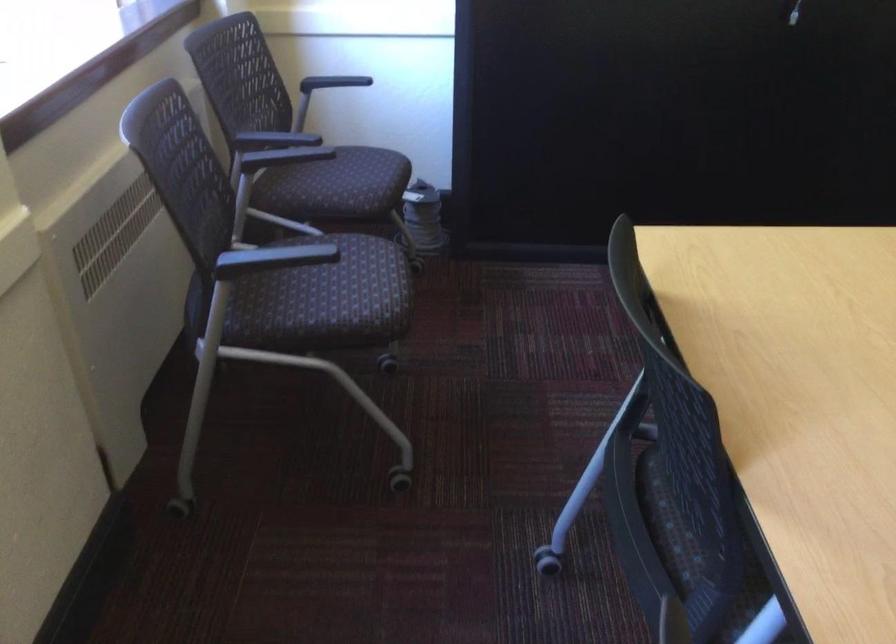
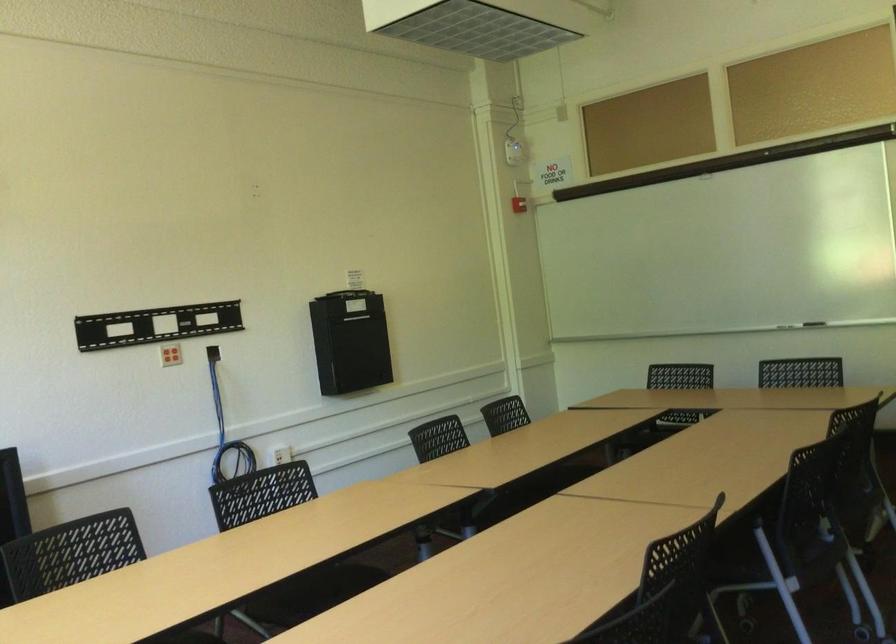
The first image is from the beginning of the video and the second image is from the end. How did the camera likely rotate when shooting the video?

The rotation direction of the camera is right-up.